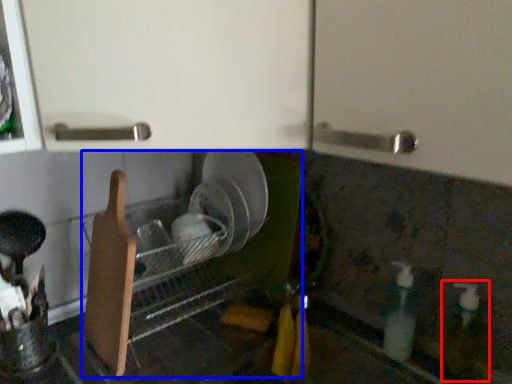
Question: Which point is closer to the camera, bottle (highlighted by a red box) or dish washer (highlighted by a blue box)?

Choices:
 (A) bottle
 (B) dish washer

Answer: (A)